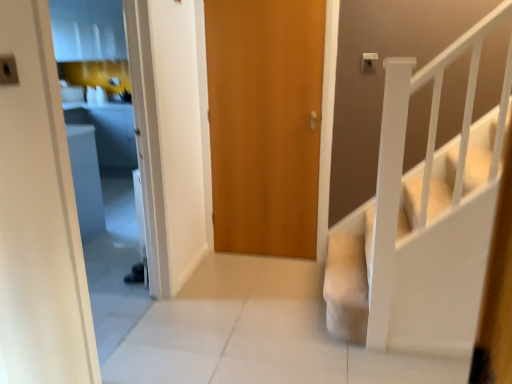
This screenshot has height=384, width=512. I want to click on free region on the left part of white painted wood stairs at right, so click(328, 358).